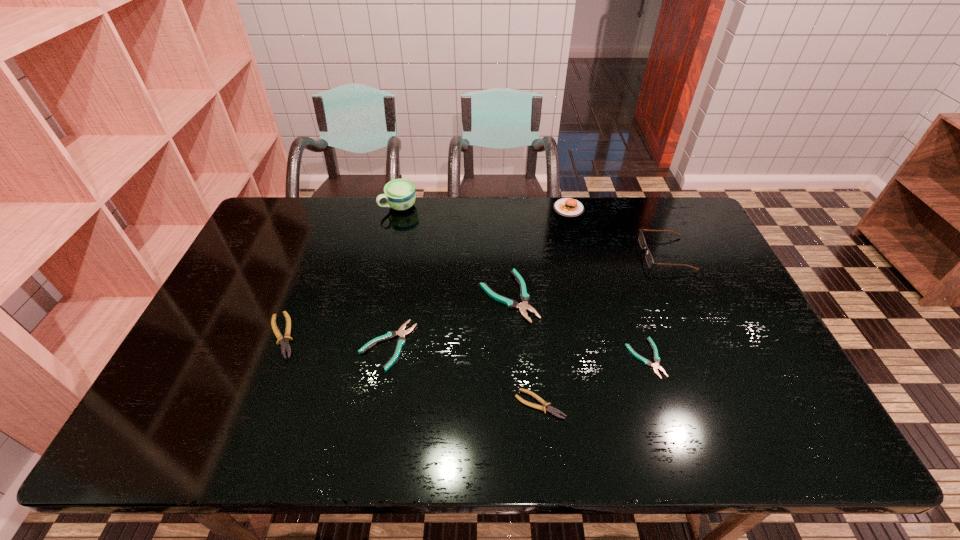
You are a GUI agent. You are given a task and a screenshot of the screen. Output one action in this format:
    pyautogui.click(x=<x>, y=<y>)
    Task: Click on the smaller yellow pliers
    
    Given the screenshot: What is the action you would take?
    pyautogui.click(x=549, y=409)

I want to click on the seventh object from left to right, so click(x=655, y=365).

Identify the location of the shortest object. The height and width of the screenshot is (540, 960). (655, 365).

This screenshot has width=960, height=540. I want to click on vacant space located 0.170m on the right of the blue cup, so click(464, 206).

At what (x,y) coordinates should I click in order to perform the action: click on free spot located 0.110m on the front-facing side of the spectacles. Please return your answer as a coordinate pair (x, y). This screenshot has height=540, width=960. Looking at the image, I should click on (609, 254).

Locate an element on the screen. The image size is (960, 540). free space located 0.370m on the front-facing side of the spectacles is located at coordinates (528, 254).

The image size is (960, 540). I want to click on vacant area located on the front-facing side of the spectacles, so click(534, 254).

Image resolution: width=960 pixels, height=540 pixels. I want to click on vacant area situated 0.250m on the right of the food, so click(654, 209).

Find the location of a particular element. The width and height of the screenshot is (960, 540). vacant space located 0.180m on the right of the second teal pliers from right to left is located at coordinates (600, 296).

Locate an element on the screen. vacant area situated on the back of the leftmost object is located at coordinates (303, 282).